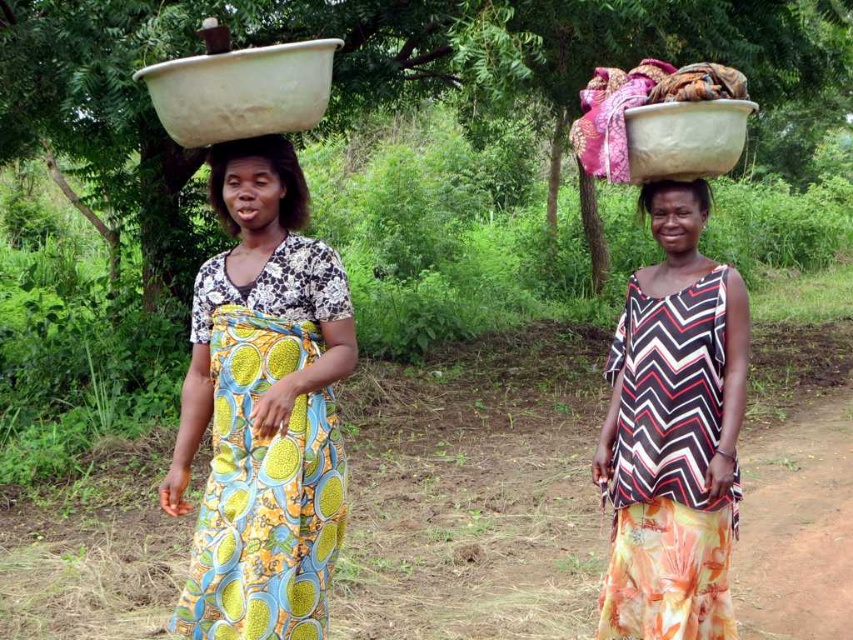
Question: Which point is closer to the camera?

Choices:
 (A) (503, 397)
 (B) (650, 182)

Answer: (B)

Question: Can you confirm if white matte bowl at upper right is positioned to the right of matte plastic bowl at upper center?

Choices:
 (A) yes
 (B) no

Answer: (A)

Question: Which object appears closest to the camera in this image?

Choices:
 (A) matte plastic bowl at upper center
 (B) matte black bowl at upper center
 (C) white matte bowl at upper right
 (D) yellow printed dress at center

Answer: (D)

Question: Based on their relative distances, which object is nearer to the matte black bowl at upper center?

Choices:
 (A) yellow printed dress at center
 (B) brown soil at center
 (C) matte plastic bowl at upper center
 (D) chevron-patterned fabric dress at center

Answer: (D)

Question: Does yellow printed dress at center appear under white matte bowl at upper right?

Choices:
 (A) no
 (B) yes

Answer: (B)

Question: Is brown soil at center to the right of yellow printed dress at center from the viewer's perspective?

Choices:
 (A) no
 (B) yes

Answer: (B)